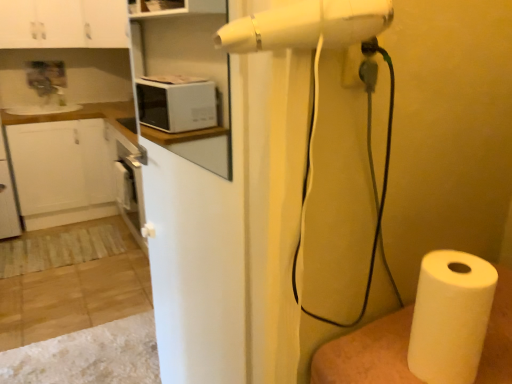
Question: Which is correct: white paper at lower right is inside white glossy cabinet at upper left, which ranks as the 1th cabinetry in left-to-right order, or outside of it?

Choices:
 (A) inside
 (B) outside

Answer: (B)

Question: In the image, is white paper at lower right on the left side or the right side of white glossy cabinet at upper left, which ranks as the 1th cabinetry in left-to-right order?

Choices:
 (A) right
 (B) left

Answer: (A)

Question: Estimate the real-world distances between objects in this image. Which object is farther from the white matte countertop at left?

Choices:
 (A) white glossy cabinet at upper left, arranged as the 2th cabinetry when viewed from the left
 (B) white glossy cabinet at upper left, placed as the second cabinetry when sorted from right to left
 (C) white matte microwave at upper left
 (D) white paper at lower right
 (E) white matte screen door at center

Answer: (D)

Question: Which of these objects is positioned closest to the white matte screen door at center?

Choices:
 (A) white glossy cabinet at upper left, arranged as the 2th cabinetry when viewed from the left
 (B) white paper at lower right
 (C) white matte microwave at upper left
 (D) white paper at lower right
 (E) white glossy cabinet at upper left, which ranks as the 1th cabinetry in left-to-right order

Answer: (C)